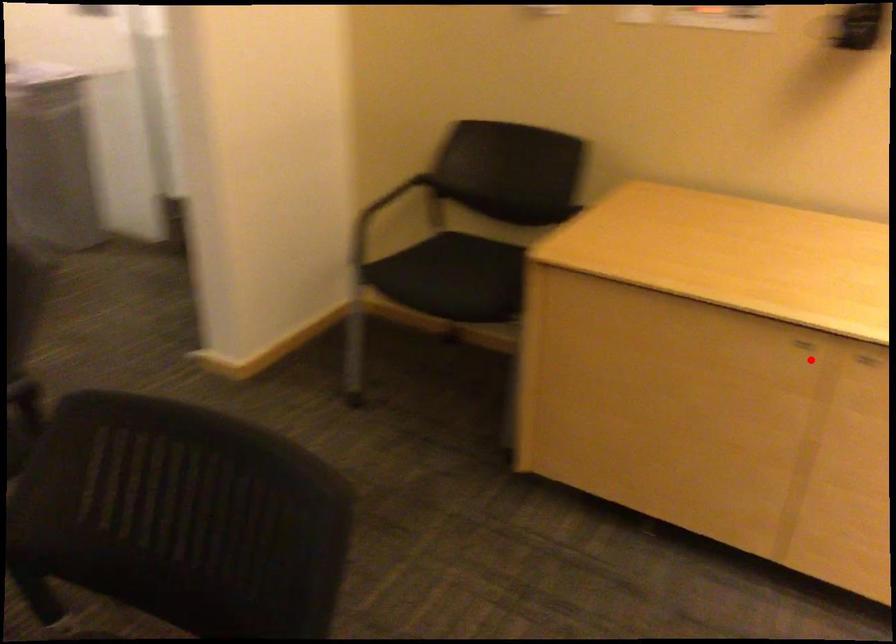
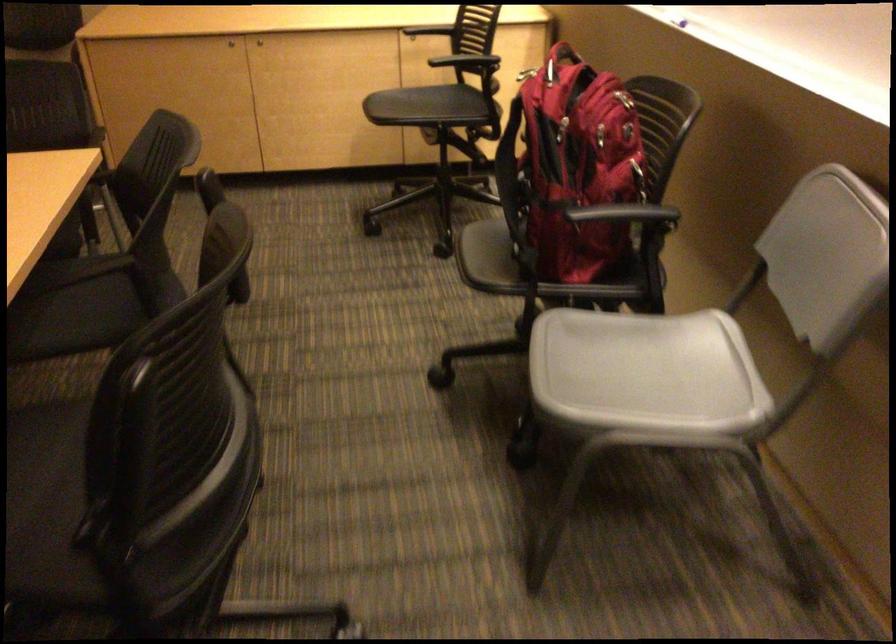
Question: I am providing you with two images of the same scene from different viewpoints. In image1, a red point is highlighted. Considering the same 3D point in image2, which of the following is correct?

Choices:
 (A) It is closer
 (B) It is farther

Answer: (B)